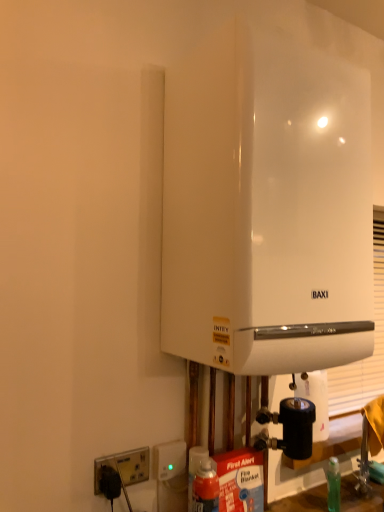
Question: From the image's perspective, is white plastic socket at lower left, the 1th electric outlet in the right-to-left sequence, located beneath white plastic socket at lower left, arranged as the second electric outlet when viewed from the right?

Choices:
 (A) no
 (B) yes

Answer: (A)

Question: Does white plastic socket at lower left, the 1th electric outlet in the right-to-left sequence, have a smaller size compared to white plastic socket at lower left, arranged as the second electric outlet when viewed from the right?

Choices:
 (A) no
 (B) yes

Answer: (A)

Question: Considering the relative positions of white plastic socket at lower left, which is the second electric outlet from left to right, and white plastic socket at lower left, placed as the first electric outlet when sorted from left to right, in the image provided, is white plastic socket at lower left, which is the second electric outlet from left to right, to the left of white plastic socket at lower left, placed as the first electric outlet when sorted from left to right, from the viewer's perspective?

Choices:
 (A) no
 (B) yes

Answer: (A)

Question: Is the position of white plastic socket at lower left, which is the second electric outlet from left to right, less distant than that of white plastic socket at lower left, arranged as the second electric outlet when viewed from the right?

Choices:
 (A) yes
 (B) no

Answer: (B)

Question: Would you say white plastic socket at lower left, which is the second electric outlet from left to right, is outside white plastic socket at lower left, arranged as the second electric outlet when viewed from the right?

Choices:
 (A) no
 (B) yes

Answer: (B)

Question: In terms of width, does white matte paper towel at lower right look wider or thinner when compared to white plastic socket at lower left, arranged as the second electric outlet when viewed from the right?

Choices:
 (A) wide
 (B) thin

Answer: (A)

Question: Is white matte paper towel at lower right situated inside white plastic socket at lower left, arranged as the second electric outlet when viewed from the right, or outside?

Choices:
 (A) outside
 (B) inside

Answer: (A)

Question: Is white matte paper towel at lower right in front of or behind white plastic socket at lower left, arranged as the second electric outlet when viewed from the right, in the image?

Choices:
 (A) front
 (B) behind

Answer: (B)

Question: Visually, is white matte paper towel at lower right positioned to the left or to the right of white plastic socket at lower left, arranged as the second electric outlet when viewed from the right?

Choices:
 (A) left
 (B) right

Answer: (B)

Question: From a real-world perspective, is white glossy boiler at center positioned above or below white plastic socket at lower left, which is the second electric outlet from left to right?

Choices:
 (A) below
 (B) above

Answer: (B)

Question: Looking at the image, does white glossy boiler at center seem bigger or smaller compared to white plastic socket at lower left, which is the second electric outlet from left to right?

Choices:
 (A) big
 (B) small

Answer: (A)

Question: Is white glossy boiler at center to the left or to the right of white plastic socket at lower left, the 1th electric outlet in the right-to-left sequence, in the image?

Choices:
 (A) right
 (B) left

Answer: (A)

Question: From the image's perspective, relative to white plastic socket at lower left, the 1th electric outlet in the right-to-left sequence, is white glossy boiler at center above or below?

Choices:
 (A) above
 (B) below

Answer: (A)

Question: Do you think white plastic socket at lower left, placed as the first electric outlet when sorted from left to right, is within white glossy boiler at center, or outside of it?

Choices:
 (A) outside
 (B) inside

Answer: (A)

Question: In the image, is white plastic socket at lower left, placed as the first electric outlet when sorted from left to right, positioned in front of or behind white glossy boiler at center?

Choices:
 (A) behind
 (B) front

Answer: (A)